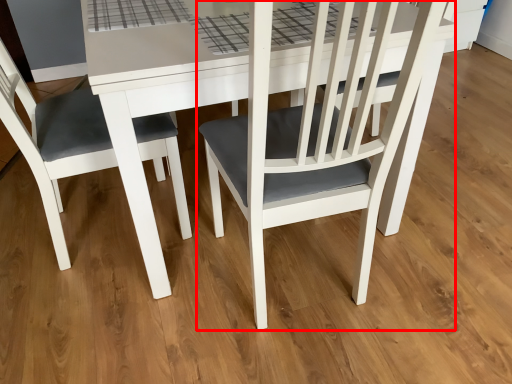
Question: Considering the relative positions of chair (annotated by the red box) and chair in the image provided, where is chair (annotated by the red box) located with respect to the staircase?

Choices:
 (A) right
 (B) left

Answer: (A)